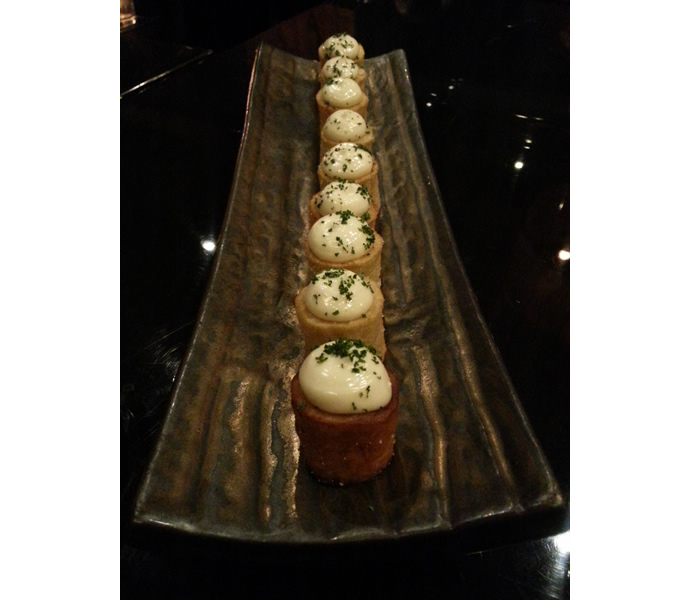
Image resolution: width=690 pixels, height=600 pixels. Identify the location of white light. (559, 542).